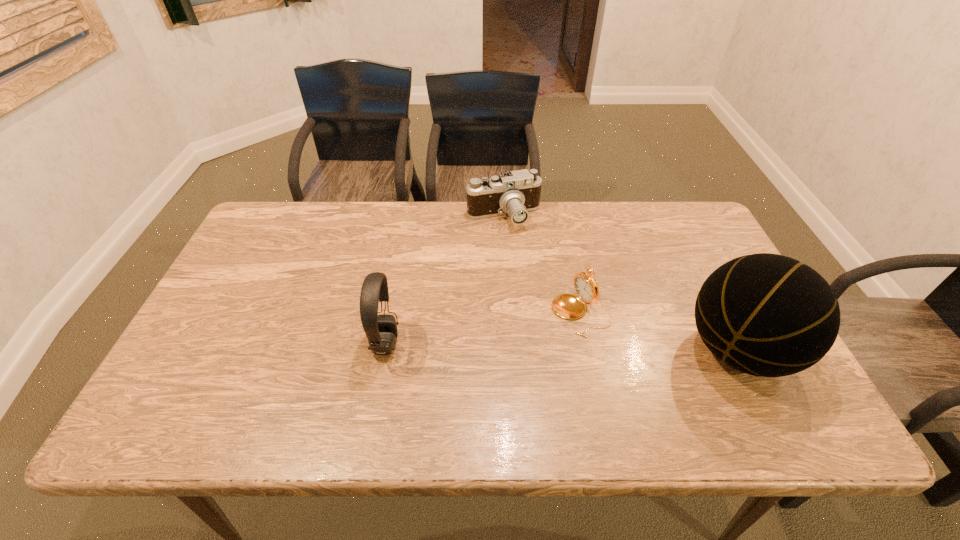
Where is `free space located 0.370m on the face of the pocket watch`? This screenshot has height=540, width=960. free space located 0.370m on the face of the pocket watch is located at coordinates (424, 386).

Where is `free space located at the lens of the camera`? free space located at the lens of the camera is located at coordinates (526, 309).

At what (x,y) coordinates should I click in order to perform the action: click on vacant point located at the lens of the camera. Please return your answer as a coordinate pair (x, y). Looking at the image, I should click on (514, 254).

I want to click on vacant point located at the lens of the camera, so point(531,330).

Image resolution: width=960 pixels, height=540 pixels. Find the location of `object that is positioned at the far edge`. object that is positioned at the far edge is located at coordinates (515, 193).

I want to click on headset positioned at the near edge, so click(381, 330).

I want to click on basketball at the near edge, so click(x=768, y=315).

You are a GUI agent. You are given a task and a screenshot of the screen. Output one action in this format:
    pyautogui.click(x=<x>, y=<y>)
    Task: Click on the object that is at the right edge
    Image resolution: width=960 pixels, height=540 pixels.
    Given the screenshot: What is the action you would take?
    pyautogui.click(x=768, y=315)

This screenshot has height=540, width=960. I want to click on object positioned at the near right corner, so click(768, 315).

Identify the location of free space at the far edge of the desktop. (644, 221).